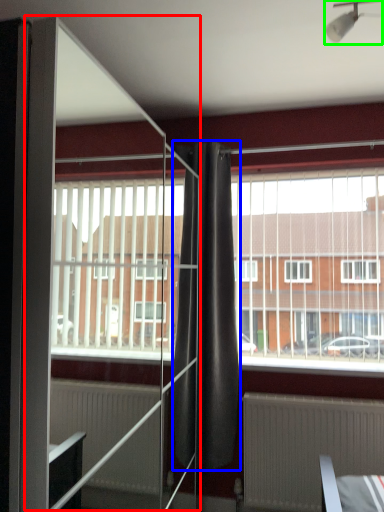
Question: Which is farther away from screen door (highlighted by a red box)? curtain (highlighted by a blue box) or light fixture (highlighted by a green box)?

Choices:
 (A) curtain
 (B) light fixture

Answer: (B)